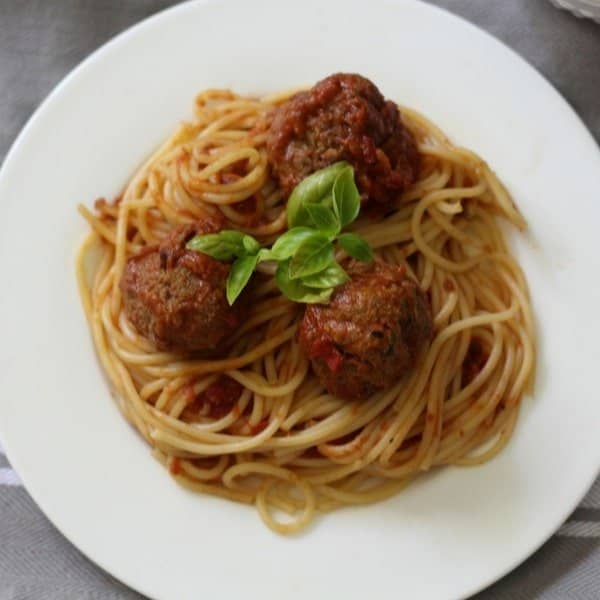
I want to click on table space around the plate, so click(581, 567), click(56, 572), click(36, 65), click(75, 20), click(525, 25), click(579, 68).